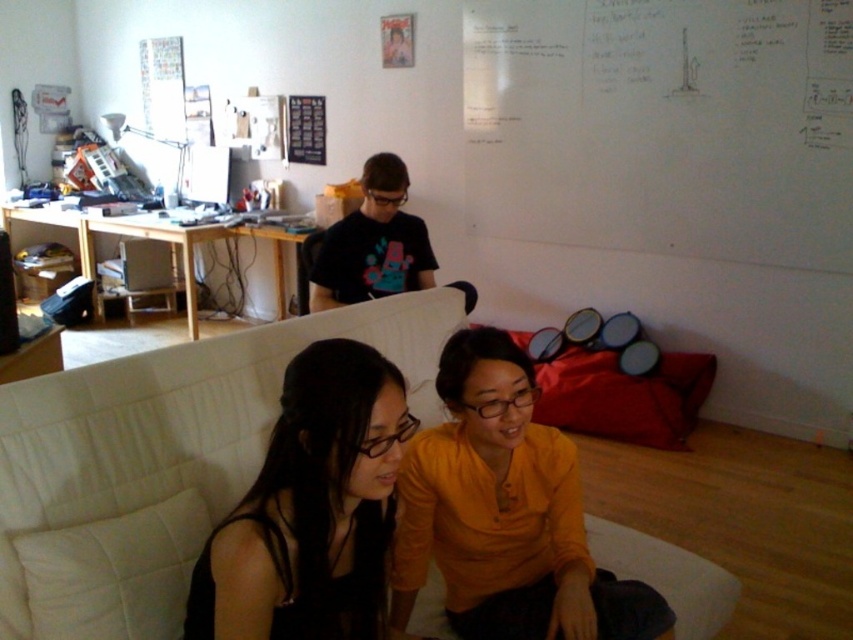
Question: Among these objects, which one is farthest from the camera?

Choices:
 (A) black matte hair at lower left
 (B) white paperboard at upper right
 (C) matte black shirt at center
 (D) black matte t-shirt at upper center

Answer: (B)

Question: Does matte black shirt at center appear on the right side of black matte t-shirt at upper center?

Choices:
 (A) no
 (B) yes

Answer: (B)

Question: Is black matte hair at lower left to the left of black matte t-shirt at upper center from the viewer's perspective?

Choices:
 (A) no
 (B) yes

Answer: (A)

Question: Which is farther from the matte black shirt at center?

Choices:
 (A) black matte t-shirt at upper center
 (B) black matte hair at lower left
 (C) white paperboard at upper right

Answer: (C)

Question: Is matte black shirt at center thinner than black matte hair at lower left?

Choices:
 (A) no
 (B) yes

Answer: (A)

Question: Among these points, which one is nearest to the camera?

Choices:
 (A) (758, 164)
 (B) (397, 564)

Answer: (B)